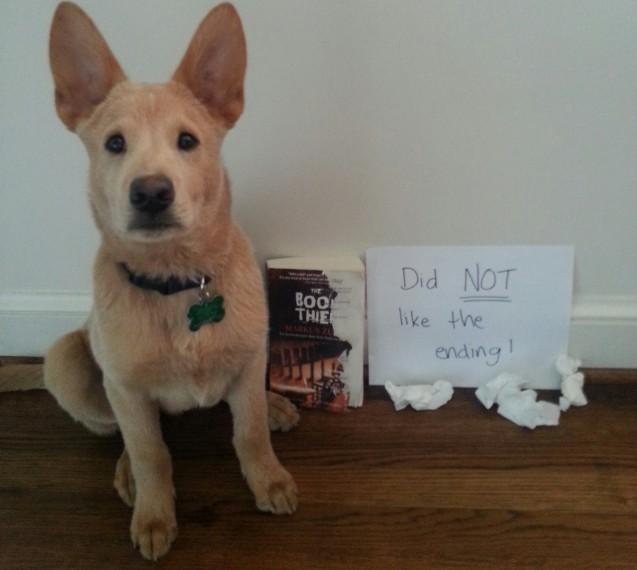
Identify the location of torn book cover. (322, 272), (332, 291), (327, 321), (348, 343), (337, 373).